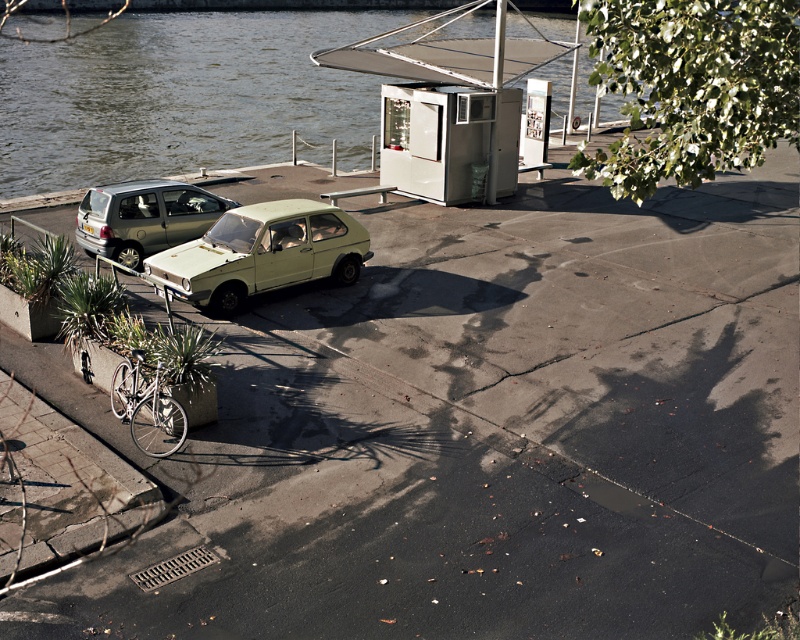
Does light green matte car at center appear over matte green car at left?

Incorrect, light green matte car at center is not positioned above matte green car at left.

Is light green matte car at center closer to camera compared to matte green car at left?

Yes, it is.

Identify the location of light green matte car at center. This screenshot has height=640, width=800. (262, 253).